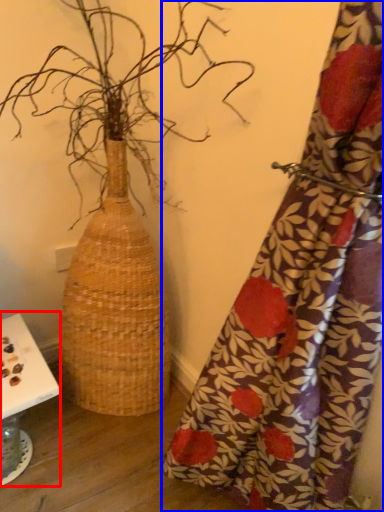
Question: Which of the following is the farthest to the observer, table (highlighted by a red box) or curtain (highlighted by a blue box)?

Choices:
 (A) table
 (B) curtain

Answer: (A)